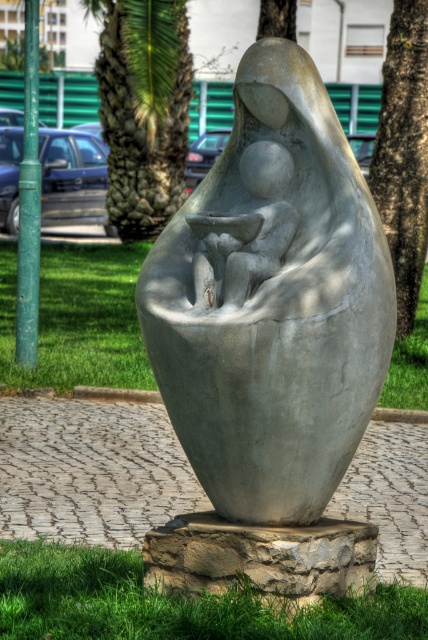
Can you confirm if green grass at center is thinner than green leafy palm tree at center?

Correct, green grass at center's width is less than green leafy palm tree at center's.

Which of these two, green grass at center or green leafy palm tree at center, stands taller?

With more height is green leafy palm tree at center.

Between point (5, 268) and point (136, 86), which one is positioned in front?

Positioned in front is point (5, 268).

Locate an element on the screen. This screenshot has width=428, height=640. green grass at center is located at coordinates (79, 317).

What do you see at coordinates (272, 300) in the screenshot? The height and width of the screenshot is (640, 428). I see `gray stone sculpture at center` at bounding box center [272, 300].

Does gray stone sculpture at center have a greater height compared to green grass at base?

Yes.

Find the location of a particular element. gray stone sculpture at center is located at coordinates (272, 300).

Find the location of `gray stone sculpture at center`. gray stone sculpture at center is located at coordinates (272, 300).

Between point (59, 577) and point (284, 32), which one is positioned in front?

Point (59, 577)

In the scene shown: Does green grass at base have a lesser width compared to green leafy tree at upper center?

No.

Measure the distance between point (x=124, y=627) and camera.

Point (x=124, y=627) and camera are 15.91 feet apart.

Where is `green grass at base`? Image resolution: width=428 pixels, height=640 pixels. green grass at base is located at coordinates (175, 604).